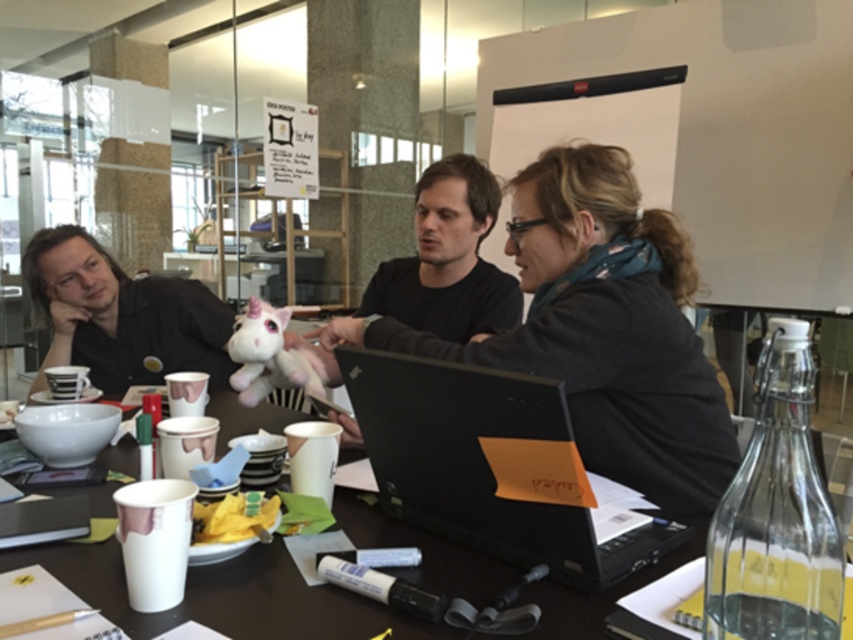
Question: Which point appears farthest from the camera in this image?

Choices:
 (A) (625, 380)
 (B) (161, 348)

Answer: (B)

Question: Which object is positioned farthest from the white paper cup at center?

Choices:
 (A) black matte shirt at left
 (B) matte black jacket at center
 (C) matte black shirt at center
 (D) pink plush unicorn at center

Answer: (A)

Question: Does black matte shirt at left appear under pink plush unicorn at center?

Choices:
 (A) yes
 (B) no

Answer: (B)

Question: Can you confirm if black matte shirt at left is bigger than pink plush unicorn at center?

Choices:
 (A) no
 (B) yes

Answer: (B)

Question: Does black matte shirt at left appear on the left side of matte black shirt at center?

Choices:
 (A) no
 (B) yes

Answer: (B)

Question: Among these objects, which one is farthest from the camera?

Choices:
 (A) pink plush unicorn at center
 (B) matte black shirt at center

Answer: (B)